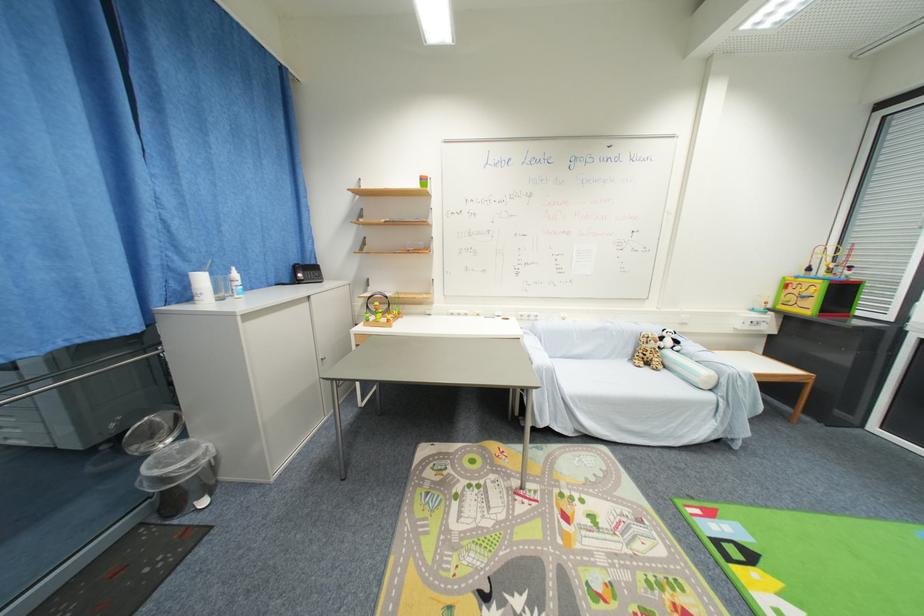
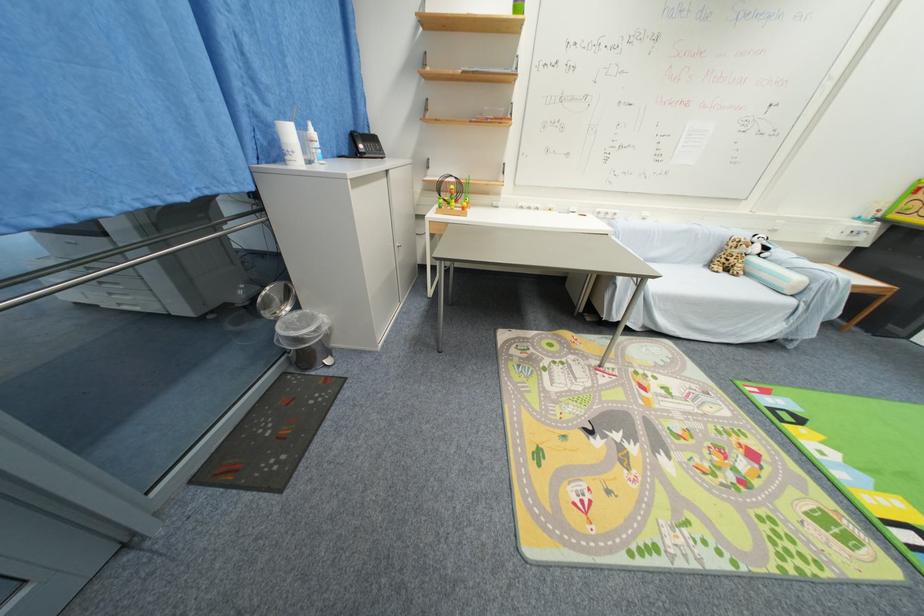
Find the pixel in the second image that matches (x=674, y=344) in the first image.

(761, 251)